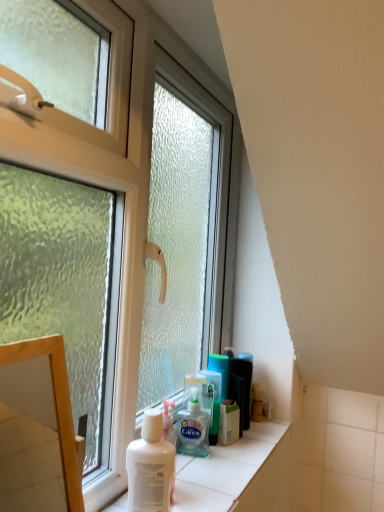
You are a GUI agent. You are given a task and a screenshot of the screen. Output one action in this format:
    pyautogui.click(x=<x>, y=<y>)
    Task: Click on the wooden frame at left
    The width and height of the screenshot is (384, 512).
    Given the screenshot: What is the action you would take?
    pyautogui.click(x=56, y=408)

Identify the location of translucent plastic shaving cream at lower center, positioned as the 2th shaving cream in front-to-back order. This screenshot has width=384, height=512. (193, 428).

The width and height of the screenshot is (384, 512). In order to click on wooden frame at left in this screenshot , I will do `click(56, 408)`.

Is the depth of white matte shaving cream at lower center, which is counted as the second shaving cream, starting from the back, greater than that of transparent glass window at center?

Yes, it is.

Are white matte shaving cream at lower center, the first shaving cream positioned from the front, and transparent glass window at center beside each other?

There is a gap between white matte shaving cream at lower center, the first shaving cream positioned from the front, and transparent glass window at center.

Considering the sizes of objects white matte shaving cream at lower center, the first shaving cream positioned from the front, and transparent glass window at center in the image provided, who is thinner, white matte shaving cream at lower center, the first shaving cream positioned from the front, or transparent glass window at center?

white matte shaving cream at lower center, the first shaving cream positioned from the front, is thinner.

From the image's perspective, is white matte shaving cream at lower center, the first shaving cream positioned from the front, on transparent glass window at center?

Actually, white matte shaving cream at lower center, the first shaving cream positioned from the front, appears below transparent glass window at center in the image.

Considering the sizes of objects transparent glass window at center and white matte shaving cream at lower center, which is counted as the second shaving cream, starting from the back, in the image provided, who is thinner, transparent glass window at center or white matte shaving cream at lower center, which is counted as the second shaving cream, starting from the back,?

With smaller width is white matte shaving cream at lower center, which is counted as the second shaving cream, starting from the back.

Consider the image. Considering the relative sizes of transparent glass window at center and white matte shaving cream at lower center, which is counted as the second shaving cream, starting from the back, in the image provided, is transparent glass window at center bigger than white matte shaving cream at lower center, which is counted as the second shaving cream, starting from the back,?

Indeed, transparent glass window at center has a larger size compared to white matte shaving cream at lower center, which is counted as the second shaving cream, starting from the back.

Can you confirm if transparent glass window at center is taller than white matte shaving cream at lower center, the first shaving cream positioned from the front?

Correct, transparent glass window at center is much taller as white matte shaving cream at lower center, the first shaving cream positioned from the front.

This screenshot has width=384, height=512. What are the coordinates of `shaving cream that is the 1st object located behind the transparent glass window at center` in the screenshot? It's located at (150, 466).

Considering the points (44, 350) and (189, 402), which point is in front, point (44, 350) or point (189, 402)?

The point (44, 350) is closer to the camera.

How far apart are wooden frame at left and translucent plastic shaving cream at lower center, the first shaving cream viewed from the back?

A distance of 35.13 centimeters exists between wooden frame at left and translucent plastic shaving cream at lower center, the first shaving cream viewed from the back.

Can you confirm if wooden frame at left is positioned to the left of translucent plastic shaving cream at lower center, positioned as the 2th shaving cream in front-to-back order?

Yes, wooden frame at left is to the left of translucent plastic shaving cream at lower center, positioned as the 2th shaving cream in front-to-back order.

Is translucent plastic shaving cream at lower center, positioned as the 2th shaving cream in front-to-back order, a part of wooden frame at left?

That's incorrect, translucent plastic shaving cream at lower center, positioned as the 2th shaving cream in front-to-back order, is not inside wooden frame at left.

Considering the sizes of objects translucent plastic shaving cream at lower center, the first shaving cream viewed from the back, and transparent glass window at center in the image provided, who is bigger, translucent plastic shaving cream at lower center, the first shaving cream viewed from the back, or transparent glass window at center?

With larger size is transparent glass window at center.

Between translucent plastic shaving cream at lower center, the first shaving cream viewed from the back, and transparent glass window at center, which one has larger width?

transparent glass window at center is wider.

Considering the relative sizes of translucent plastic shaving cream at lower center, positioned as the 2th shaving cream in front-to-back order, and transparent glass window at center in the image provided, is translucent plastic shaving cream at lower center, positioned as the 2th shaving cream in front-to-back order, shorter than transparent glass window at center?

Indeed, translucent plastic shaving cream at lower center, positioned as the 2th shaving cream in front-to-back order, has a lesser height compared to transparent glass window at center.

From the image's perspective, which is below, translucent plastic shaving cream at lower center, positioned as the 2th shaving cream in front-to-back order, or transparent glass window at center?

translucent plastic shaving cream at lower center, positioned as the 2th shaving cream in front-to-back order, from the image's perspective.

This screenshot has height=512, width=384. Identify the location of mirror below the transparent glass window at center (from the image's perspective). (56, 408).

From the image's perspective, who appears lower, wooden frame at left or transparent glass window at center?

wooden frame at left appears lower in the image.

Is wooden frame at left aimed at transparent glass window at center?

No, wooden frame at left does not turn towards transparent glass window at center.

Considering the relative sizes of transparent glass window at center and translucent plastic shaving cream at lower center, positioned as the 2th shaving cream in front-to-back order, in the image provided, is transparent glass window at center smaller than translucent plastic shaving cream at lower center, positioned as the 2th shaving cream in front-to-back order,?

No, transparent glass window at center is not smaller than translucent plastic shaving cream at lower center, positioned as the 2th shaving cream in front-to-back order.

Is transparent glass window at center completely or partially outside of translucent plastic shaving cream at lower center, positioned as the 2th shaving cream in front-to-back order?

transparent glass window at center lies outside translucent plastic shaving cream at lower center, positioned as the 2th shaving cream in front-to-back order,'s area.

Considering the positions of objects transparent glass window at center and translucent plastic shaving cream at lower center, the first shaving cream viewed from the back, in the image provided, who is more to the left, transparent glass window at center or translucent plastic shaving cream at lower center, the first shaving cream viewed from the back,?

transparent glass window at center.

Which of these two, transparent glass window at center or translucent plastic shaving cream at lower center, the first shaving cream viewed from the back, stands shorter?

translucent plastic shaving cream at lower center, the first shaving cream viewed from the back.

Which of these two, transparent glass window at center or wooden frame at left, is thinner?

wooden frame at left is thinner.

Is transparent glass window at center inside the boundaries of wooden frame at left, or outside?

transparent glass window at center exists outside the volume of wooden frame at left.

How much distance is there between transparent glass window at center and wooden frame at left?

transparent glass window at center is 40.84 centimeters from wooden frame at left.

Looking at the image, does transparent glass window at center seem bigger or smaller compared to wooden frame at left?

Clearly, transparent glass window at center is larger in size than wooden frame at left.

You are a GUI agent. You are given a task and a screenshot of the screen. Output one action in this format:
    pyautogui.click(x=<x>, y=<y>)
    Task: Click on the window in front of the white matte shaving cream at lower center, the first shaving cream positioned from the front
    This screenshot has width=384, height=512.
    Given the screenshot: What is the action you would take?
    pyautogui.click(x=115, y=180)

The width and height of the screenshot is (384, 512). Identify the location of window above the white matte shaving cream at lower center, which is counted as the second shaving cream, starting from the back (from the image's perspective). (115, 180).

Which object lies nearer to the anchor point white matte shaving cream at lower center, the first shaving cream positioned from the front, translucent plastic shaving cream at lower center, the first shaving cream viewed from the back, or wooden frame at left?

wooden frame at left lies closer to white matte shaving cream at lower center, the first shaving cream positioned from the front, than the other object.

From the image, which object appears to be nearer to white matte shaving cream at lower center, the first shaving cream positioned from the front, wooden frame at left or translucent plastic shaving cream at lower center, positioned as the 2th shaving cream in front-to-back order?

wooden frame at left lies closer to white matte shaving cream at lower center, the first shaving cream positioned from the front, than the other object.

Considering their positions, is transparent glass window at center positioned closer to white matte shaving cream at lower center, the first shaving cream positioned from the front, than wooden frame at left?

wooden frame at left is positioned closer to the anchor white matte shaving cream at lower center, the first shaving cream positioned from the front.

Consider the image. Which object lies nearer to the anchor point wooden frame at left, translucent plastic shaving cream at lower center, positioned as the 2th shaving cream in front-to-back order, or transparent glass window at center?

translucent plastic shaving cream at lower center, positioned as the 2th shaving cream in front-to-back order, lies closer to wooden frame at left than the other object.

Estimate the real-world distances between objects in this image. Which object is further from transparent glass window at center, translucent plastic shaving cream at lower center, the first shaving cream viewed from the back, or white matte shaving cream at lower center, the first shaving cream positioned from the front?

translucent plastic shaving cream at lower center, the first shaving cream viewed from the back, lies further to transparent glass window at center than the other object.

Based on their spatial positions, is transparent glass window at center or white matte shaving cream at lower center, which is counted as the second shaving cream, starting from the back, further from wooden frame at left?

transparent glass window at center.

Considering their positions, is wooden frame at left positioned further to white matte shaving cream at lower center, the first shaving cream positioned from the front, than transparent glass window at center?

The object further to white matte shaving cream at lower center, the first shaving cream positioned from the front, is transparent glass window at center.

Looking at the image, which one is located further to white matte shaving cream at lower center, the first shaving cream positioned from the front, transparent glass window at center or translucent plastic shaving cream at lower center, positioned as the 2th shaving cream in front-to-back order?

transparent glass window at center.

The image size is (384, 512). I want to click on shaving cream between transparent glass window at center and translucent plastic shaving cream at lower center, positioned as the 2th shaving cream in front-to-back order, in the front-back direction, so click(150, 466).

Image resolution: width=384 pixels, height=512 pixels. In order to click on shaving cream located between wooden frame at left and translucent plastic shaving cream at lower center, the first shaving cream viewed from the back, in the depth direction in this screenshot , I will do `click(150, 466)`.

Find the location of `mirror between transparent glass window at center and white matte shaving cream at lower center, the first shaving cream positioned from the front, in the vertical direction`. mirror between transparent glass window at center and white matte shaving cream at lower center, the first shaving cream positioned from the front, in the vertical direction is located at coordinates (56, 408).

This screenshot has height=512, width=384. In order to click on window positioned between wooden frame at left and translucent plastic shaving cream at lower center, positioned as the 2th shaving cream in front-to-back order, from near to far in this screenshot , I will do `click(115, 180)`.